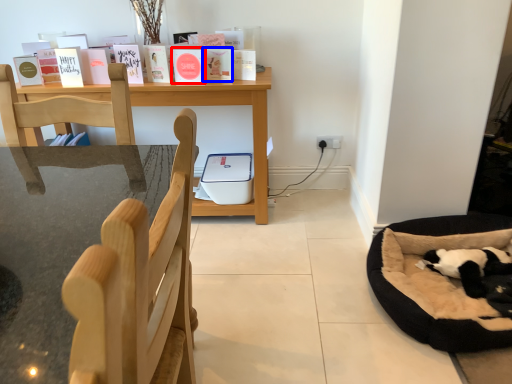
Question: Which point is closer to the camera, paperback book (highlighted by a red box) or paperback book (highlighted by a blue box)?

Choices:
 (A) paperback book
 (B) paperback book

Answer: (A)